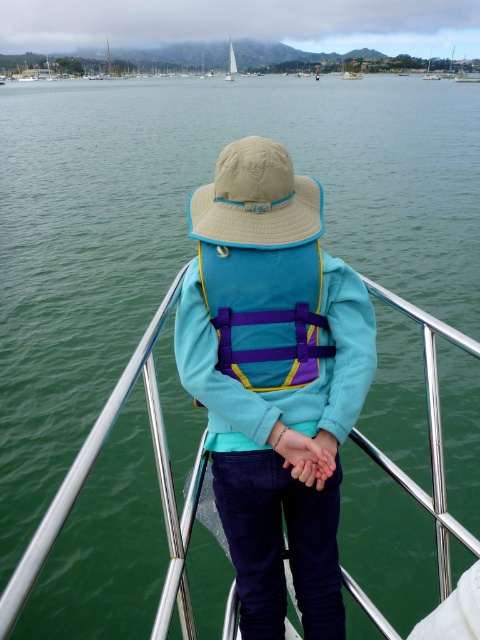
You are on a boat and need to secure your life vest. You see the matte blue life vest at center and the white sailboat at center. Which object is closer to you?

The matte blue life vest at center is closer to you because it is located below the white sailboat at center, meaning it is positioned in front of it from your perspective.

You are on a boat and need to reach the matte blue life jacket at center from your current position. The boat is 10 feet long. Can you comfortably walk the distance without stepping into water?

The distance between you and the matte blue life jacket at center is 6.81 feet, which is less than the boat length of 10 feet. Therefore, you can comfortably walk to it without stepping into water.